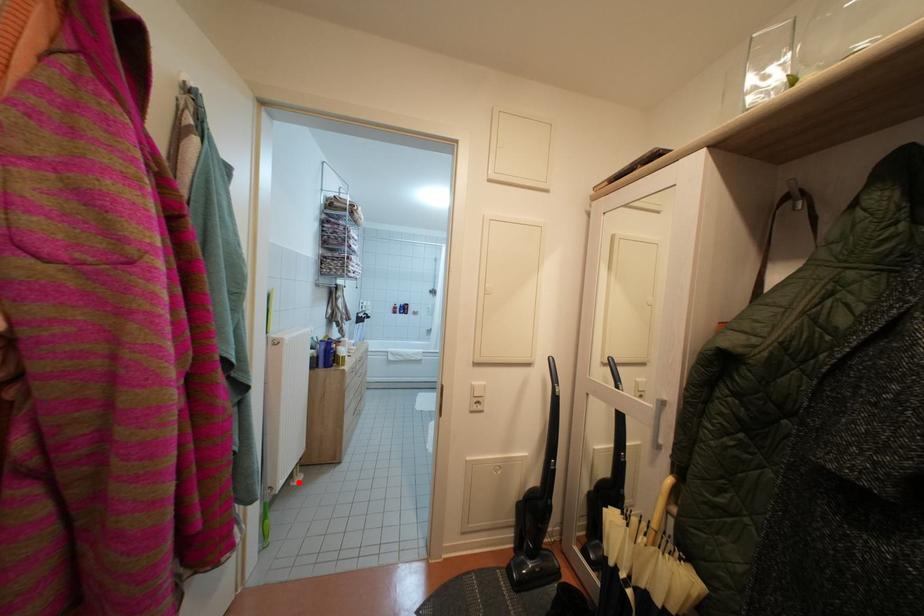
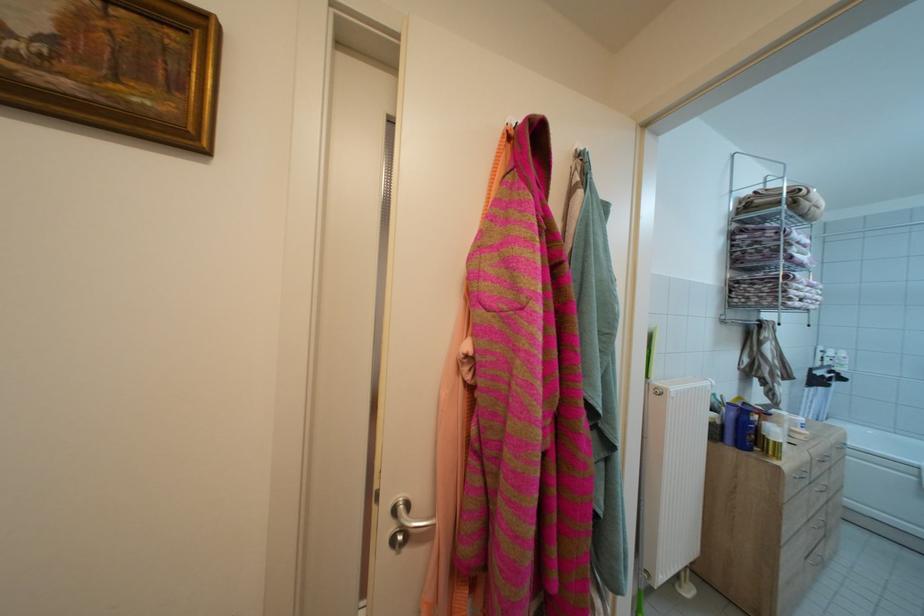
Question: I am providing you with two images of the same scene from different viewpoints. Given a red point in image1, look at the same physical point in image2. Is it:

Choices:
 (A) Closer to the viewpoint
 (B) Farther from the viewpoint

Answer: (A)